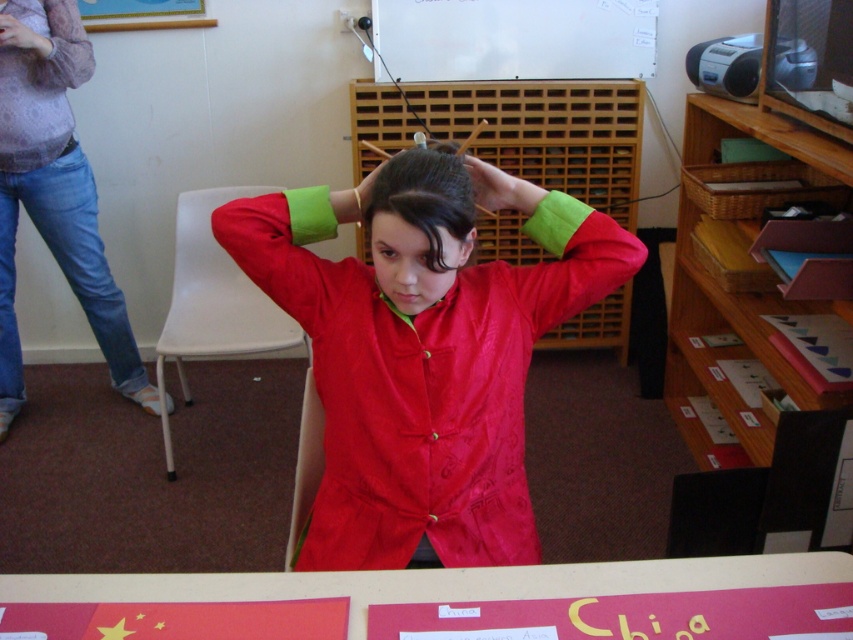
You are standing in the classroom and need to walk to the flag with yellow stars on a red background. There are two points marked in the room at coordinates point (474, 388) and point (486, 182). Which point should you pass through to reach the flag more directly?

You should pass through point (474, 388) to reach the flag with yellow stars on a red background more directly since it is in front of point (486, 182), indicating it is closer to your path towards the flag.

In the classroom scene, there is a matte red jacket at center and a matte black hand at upper left. From the perspective of someone standing in the room, which object is positioned to the right of the other?

The matte red jacket at center is to the right of the matte black hand at upper left.

You are standing in the classroom and want to hand a note to the child wearing the matte red jacket at center. Where should you approach to find the child?

The matte red jacket at center is located at the coordinates point (416, 225), so you should approach that position to find the child wearing the matte red jacket at center.